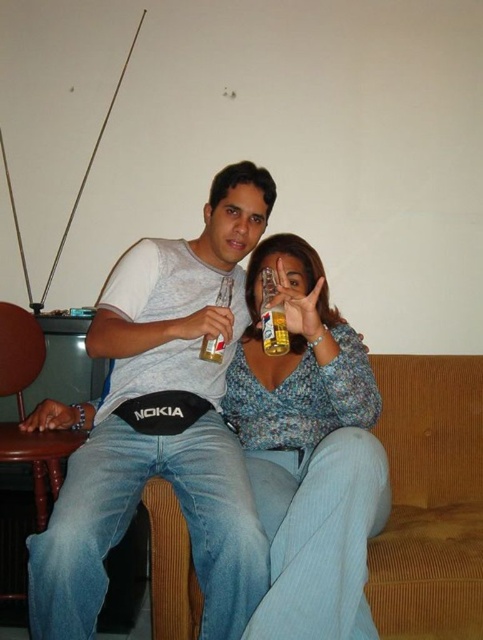
Question: Which point is closer to the camera?

Choices:
 (A) brown corduroy couch at center
 (B) brown wood chair at lower left
 (C) clear glass beer bottle at center

Answer: (A)

Question: Does brown wood chair at lower left appear over clear glass beer bottle at center?

Choices:
 (A) no
 (B) yes

Answer: (A)

Question: Which object appears farthest from the camera in this image?

Choices:
 (A) translucent glass beer bottle at center
 (B) brown corduroy couch at center
 (C) brown wood chair at lower left
 (D) white cotton shirt at center

Answer: (C)

Question: From the image, what is the correct spatial relationship of white cotton shirt at center in relation to translucent glass beer bottle at center?

Choices:
 (A) right
 (B) left

Answer: (B)

Question: Which of these objects is positioned closest to the brown wood chair at lower left?

Choices:
 (A) translucent glass beer bottle at center
 (B) brown corduroy couch at center
 (C) floral blouse at center

Answer: (C)

Question: Is white cotton shirt at center to the right of brown wood chair at lower left from the viewer's perspective?

Choices:
 (A) no
 (B) yes

Answer: (B)